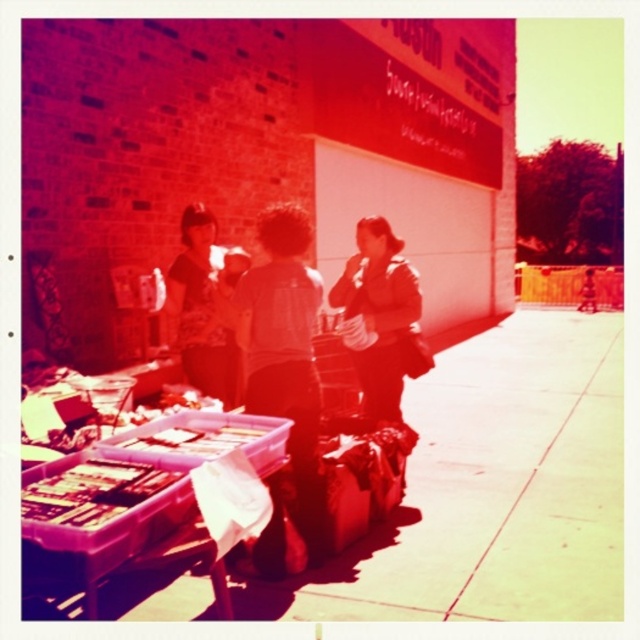
You are standing in front of the table with the white cloth and see both the matte brown jacket at center and the matte black shirt at center. From your perspective, which one is positioned to the right?

The matte brown jacket at center is to the right of the matte black shirt at center.